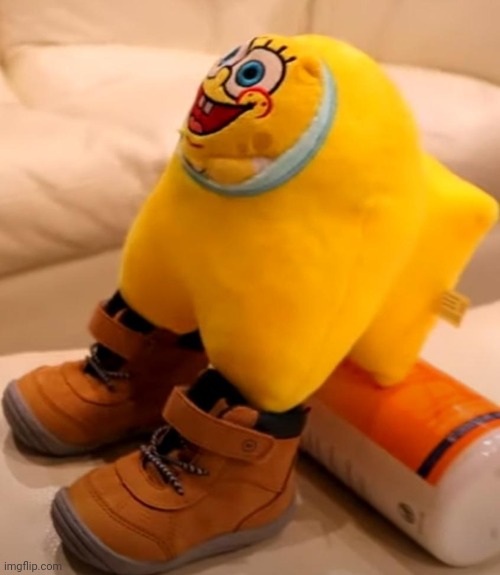
You are a GUI agent. You are given a task and a screenshot of the screen. Output one action in this format:
    pyautogui.click(x=<x>, y=<y>)
    Task: Click on the sponge
    
    Given the screenshot: What is the action you would take?
    pyautogui.click(x=311, y=281)